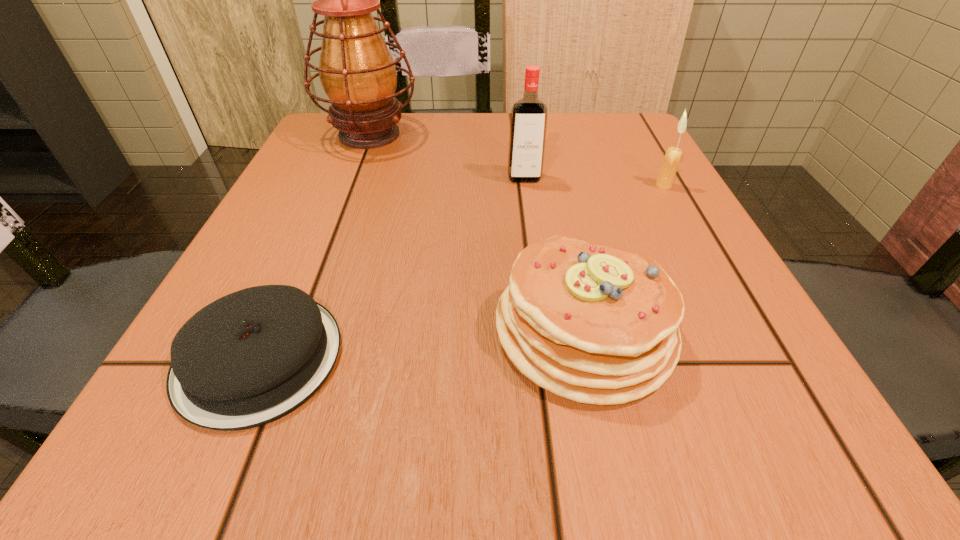
What are the coordinates of `object that is positioned at the near left corner` in the screenshot? It's located at (251, 357).

In order to click on object that is at the near right corner in this screenshot , I will do `click(595, 324)`.

You are a GUI agent. You are given a task and a screenshot of the screen. Output one action in this format:
    pyautogui.click(x=<x>, y=<y>)
    Task: Click on the vacant area at the far edge
    The width and height of the screenshot is (960, 540).
    Given the screenshot: What is the action you would take?
    pyautogui.click(x=405, y=113)

Image resolution: width=960 pixels, height=540 pixels. In the image, there is a desktop. In order to click on vacant space at the near edge in this screenshot , I will do `click(514, 395)`.

In the image, there is a desktop. In order to click on vacant space at the left edge in this screenshot , I will do `click(293, 216)`.

Identify the location of vacant position at the right edge of the desktop. The width and height of the screenshot is (960, 540). (636, 195).

This screenshot has height=540, width=960. Find the location of `free space at the near left corner of the desktop`. free space at the near left corner of the desktop is located at coordinates (252, 450).

What are the coordinates of `vacant space at the far right corner of the desktop` in the screenshot? It's located at (636, 154).

This screenshot has height=540, width=960. Identify the location of vacant space at the near right corner of the desktop. (693, 444).

Locate an element on the screen. This screenshot has width=960, height=540. empty space between the second tallest object and the rightmost object is located at coordinates (594, 182).